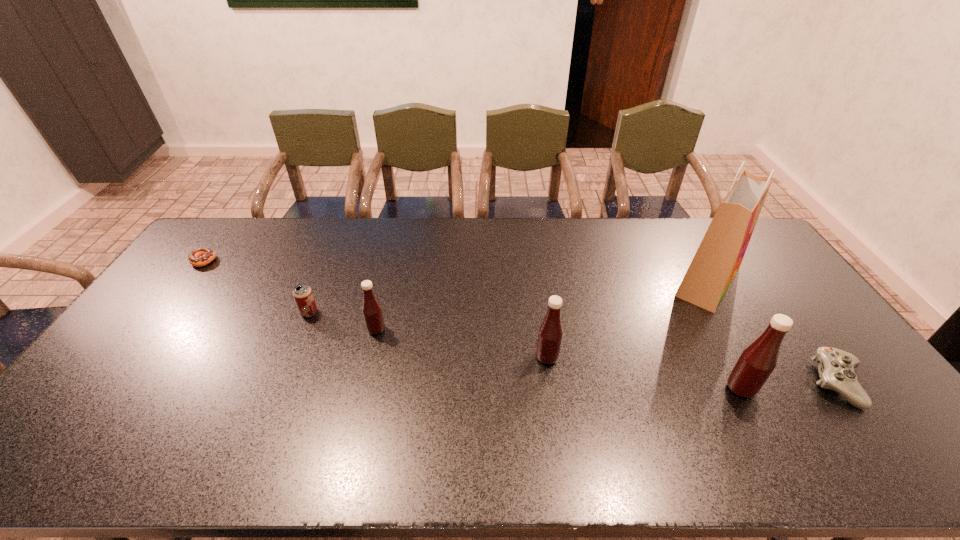
Please point a spot on the left to add another Tabasco sauce. Please provide its 2D coordinates. Your answer should be formatted as a tuple, i.e. [(x, y)], where the tuple contains the x and y coordinates of a point satisfying the conditions above.

[(225, 306)]